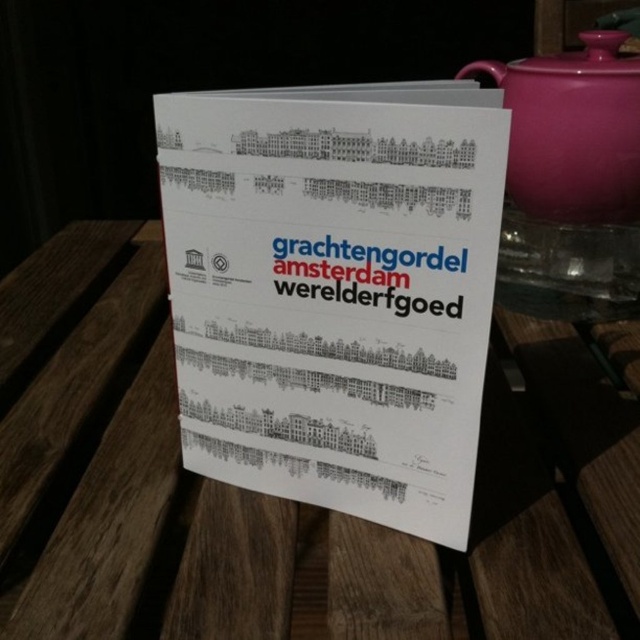
Question: Which of the following is the closest to the observer?

Choices:
 (A) white paper sign at center
 (B) matte pink ceramic teapot at upper right

Answer: (B)

Question: Which object is the farthest from the white paper sign at center?

Choices:
 (A) wooden picnic table at center
 (B) matte pink ceramic teapot at upper right

Answer: (B)

Question: Which point appears farthest from the camera in this image?

Choices:
 (A) (556, 202)
 (B) (275, 544)
 (C) (404, 241)

Answer: (A)

Question: Does wooden picnic table at center appear on the left side of matte pink ceramic teapot at upper right?

Choices:
 (A) no
 (B) yes

Answer: (B)

Question: From the image, what is the correct spatial relationship of wooden picnic table at center in relation to matte pink ceramic teapot at upper right?

Choices:
 (A) left
 (B) right

Answer: (A)

Question: Is wooden picnic table at center further to the viewer compared to white paper sign at center?

Choices:
 (A) yes
 (B) no

Answer: (A)